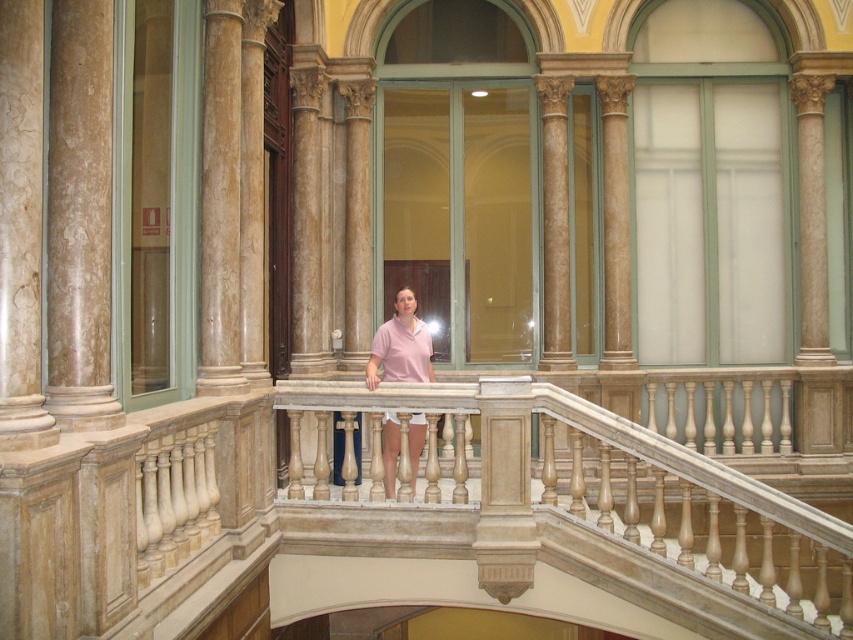
Question: Does beige marble balustrade at center lie in front of pink matte shirt at center?

Choices:
 (A) no
 (B) yes

Answer: (B)

Question: From the image, what is the correct spatial relationship of beige marble balustrade at center in relation to pink matte shirt at center?

Choices:
 (A) right
 (B) left

Answer: (A)

Question: Among these points, which one is farthest from the camera?

Choices:
 (A) (428, 372)
 (B) (320, 451)

Answer: (A)

Question: Which point is closer to the camera?

Choices:
 (A) beige marble balustrade at center
 (B) pink matte shirt at center

Answer: (A)

Question: Can you confirm if beige marble balustrade at center is bigger than pink matte shirt at center?

Choices:
 (A) yes
 (B) no

Answer: (A)